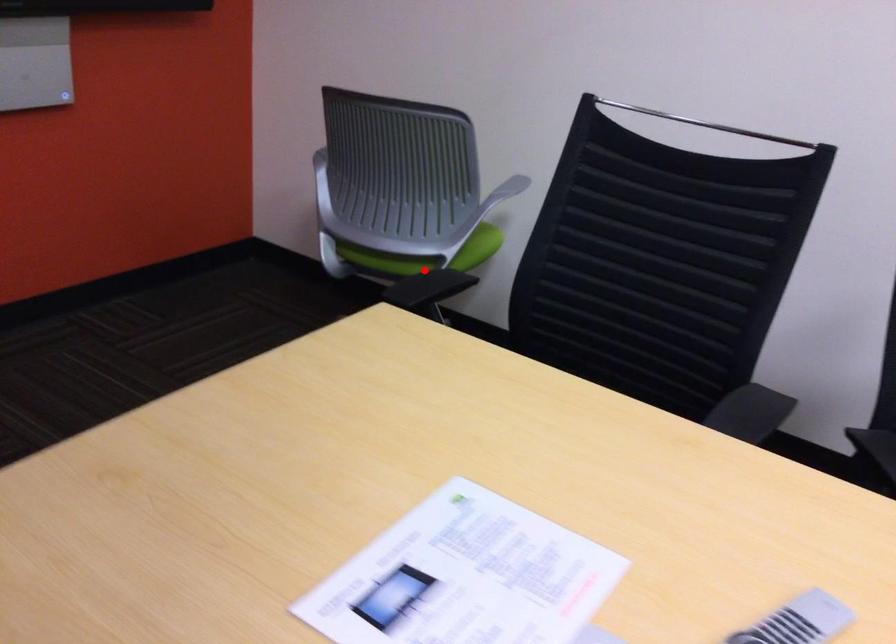
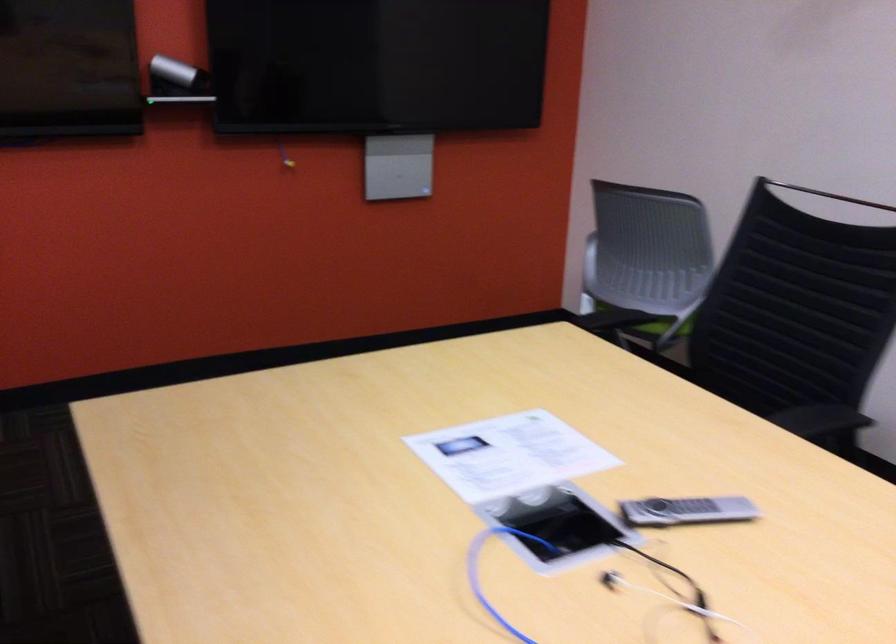
The point at the highlighted location is marked in the first image. Where is the corresponding point in the second image?

(653, 325)